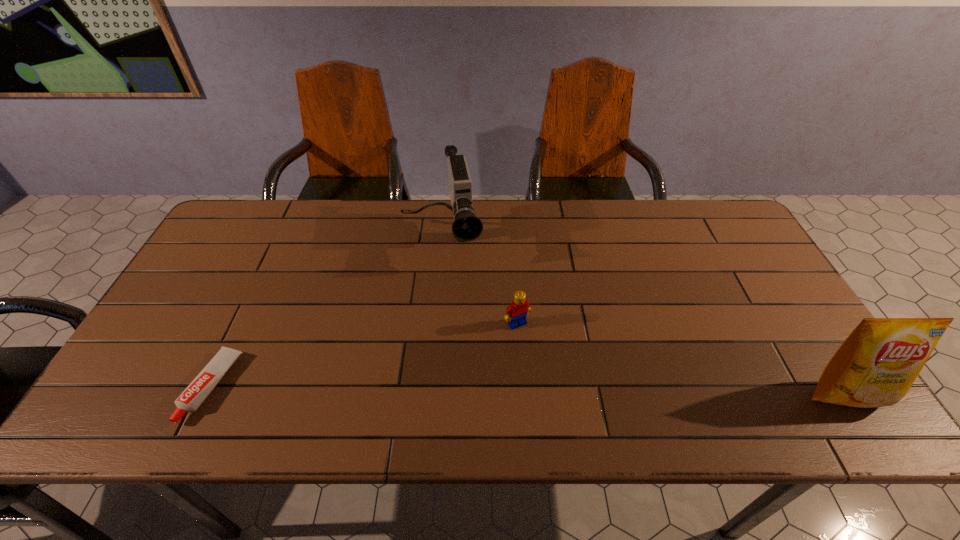
Image resolution: width=960 pixels, height=540 pixels. I want to click on vacant area that lies between the farthest object and the rightmost object, so click(643, 316).

Identify the location of vacant region between the camcorder and the leftmost object. The image size is (960, 540). (326, 313).

Locate an element on the screen. The image size is (960, 540). free space between the crisp (potato chip) and the farthest object is located at coordinates (643, 316).

Where is `free area in between the farthest object and the shortest object`? The height and width of the screenshot is (540, 960). free area in between the farthest object and the shortest object is located at coordinates (326, 313).

In order to click on free spot between the crisp (potato chip) and the third object from right to left in this screenshot , I will do `click(643, 316)`.

You are a GUI agent. You are given a task and a screenshot of the screen. Output one action in this format:
    pyautogui.click(x=<x>, y=<y>)
    Task: Click on the unoccupied position between the third object from right to left and the rightmost object
    
    Given the screenshot: What is the action you would take?
    pyautogui.click(x=643, y=316)

The image size is (960, 540). What are the coordinates of `the closest object to the rightmost object` in the screenshot? It's located at (516, 313).

At what (x,y) coordinates should I click in order to perform the action: click on object that is the second closest to the rightmost object. Please return your answer as a coordinate pair (x, y). Image resolution: width=960 pixels, height=540 pixels. Looking at the image, I should click on (467, 226).

Find the location of a particular element. Image resolution: width=960 pixels, height=540 pixels. vacant position in the image that satisfies the following two spatial constraints: 1. on the front side of the camcorder; 2. on the left side of the second object from right to left is located at coordinates (434, 323).

The height and width of the screenshot is (540, 960). Identify the location of vacant space that satisfies the following two spatial constraints: 1. on the back side of the second shortest object; 2. on the right side of the leftmost object. pos(242,323).